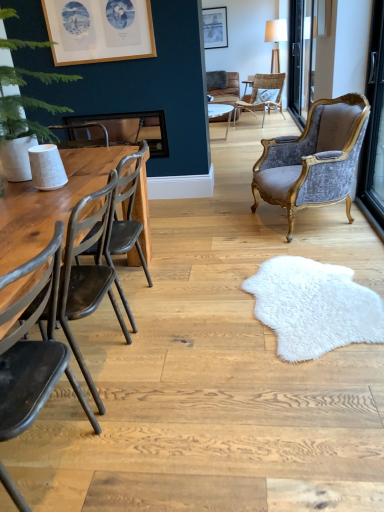
Question: Is transparent glass door at upper right wider or thinner than velvet/gold armchair at right, the 3th chair when ordered from bottom to top?

Choices:
 (A) thin
 (B) wide

Answer: (A)

Question: Based on their sizes in the image, would you say transparent glass door at upper right is bigger or smaller than velvet/gold armchair at right, the second chair positioned from the back?

Choices:
 (A) small
 (B) big

Answer: (B)

Question: Estimate the real-world distances between objects in this image. Which object is closer to the dark brown wood chair at left, acting as the second chair starting from the bottom?

Choices:
 (A) wooden table at left
 (B) matte black chair at left, marked as the fourth chair in a top-to-bottom arrangement
 (C) green leafy plant at left
 (D) velvet/gold armchair at right, which is the 3th chair in front-to-back order
 (E) matte silver picture frame at upper center, which ranks as the 1th picture frame in back-to-front order

Answer: (B)

Question: Which object is the farthest from the transparent glass door at upper right?

Choices:
 (A) rattan wicker chair at center, the first chair from the back
 (B) wooden frame at upper left, arranged as the second picture frame when viewed from the back
 (C) wooden table at left
 (D) velvet/gold armchair at right, the 3th chair when ordered from bottom to top
 (E) matte black chair at left, marked as the fourth chair in a top-to-bottom arrangement

Answer: (E)